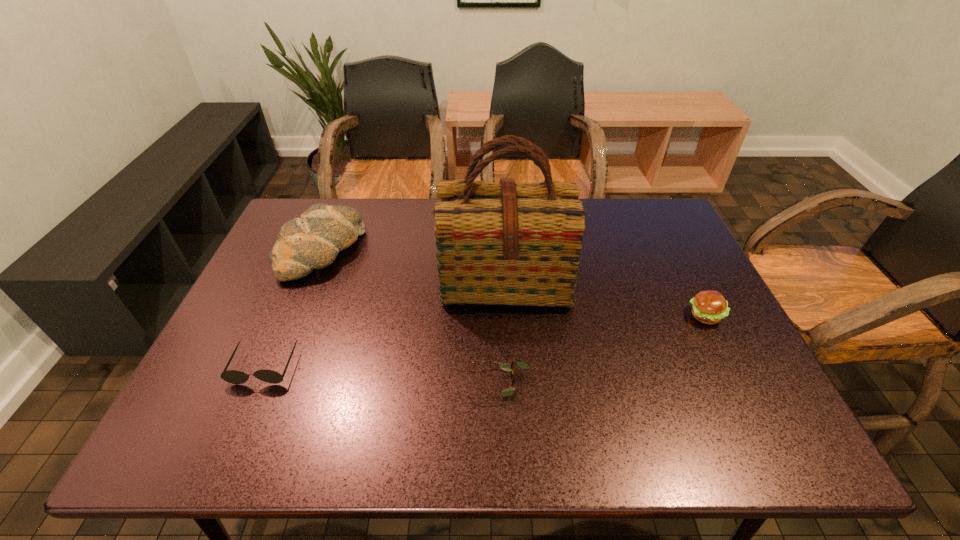
The width and height of the screenshot is (960, 540). I want to click on unoccupied position between the tallest object and the second tallest object, so click(x=414, y=266).

You are a GUI agent. You are given a task and a screenshot of the screen. Output one action in this format:
    pyautogui.click(x=<x>, y=<y>)
    Task: Click on the free space between the spectacles and the second tallest object
    The width and height of the screenshot is (960, 540).
    Given the screenshot: What is the action you would take?
    pyautogui.click(x=411, y=317)

Locate an element on the screen. The width and height of the screenshot is (960, 540). blank region between the fourth shortest object and the shortest object is located at coordinates (411, 317).

The image size is (960, 540). In order to click on object that is the third closest to the fourth shortest object in this screenshot , I will do `click(509, 367)`.

The width and height of the screenshot is (960, 540). What are the coordinates of `object that is the third closest to the hamburger` in the screenshot? It's located at (313, 241).

The image size is (960, 540). In order to click on blank space that satisfies the following two spatial constraints: 1. on the open handle side of the third shortest object; 2. on the left side of the tallest object in this screenshot , I will do point(507,315).

Find the location of a particular element. This screenshot has width=960, height=540. free point that satisfies the following two spatial constraints: 1. on the open handle side of the tallest object; 2. on the left side of the rightmost object is located at coordinates (507, 315).

The height and width of the screenshot is (540, 960). Find the location of `vacant space that satisfies the following two spatial constraints: 1. on the open handle side of the shopping bag; 2. on the front-facing side of the spectacles`. vacant space that satisfies the following two spatial constraints: 1. on the open handle side of the shopping bag; 2. on the front-facing side of the spectacles is located at coordinates (511, 383).